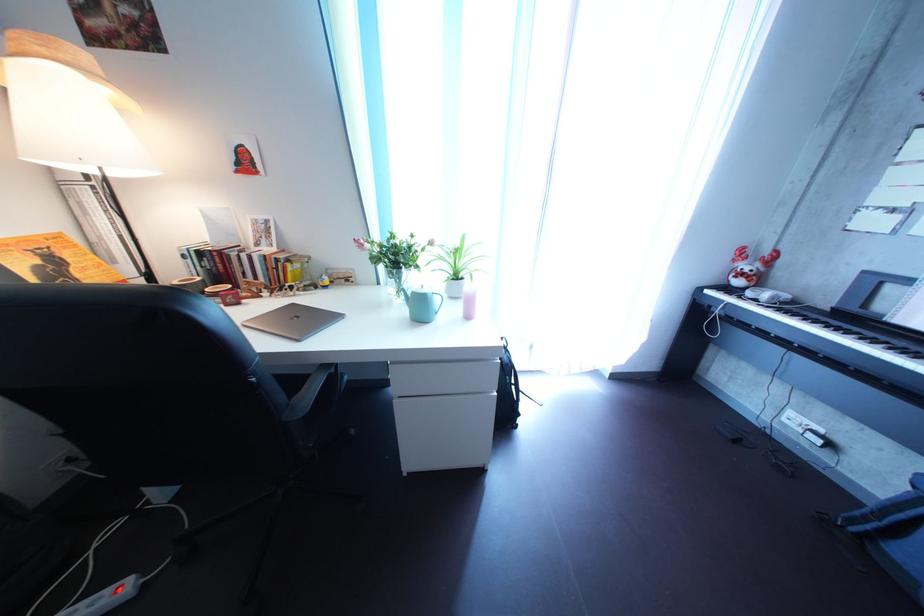
Identify the location of red power button. (105, 598).